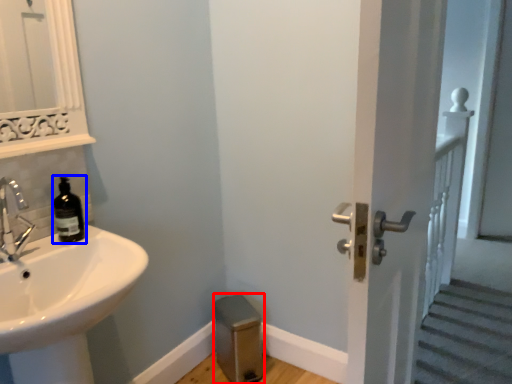
Question: Which of the following is the farthest to the observer, step stool (highlighted by a red box) or bottle (highlighted by a blue box)?

Choices:
 (A) step stool
 (B) bottle

Answer: (A)